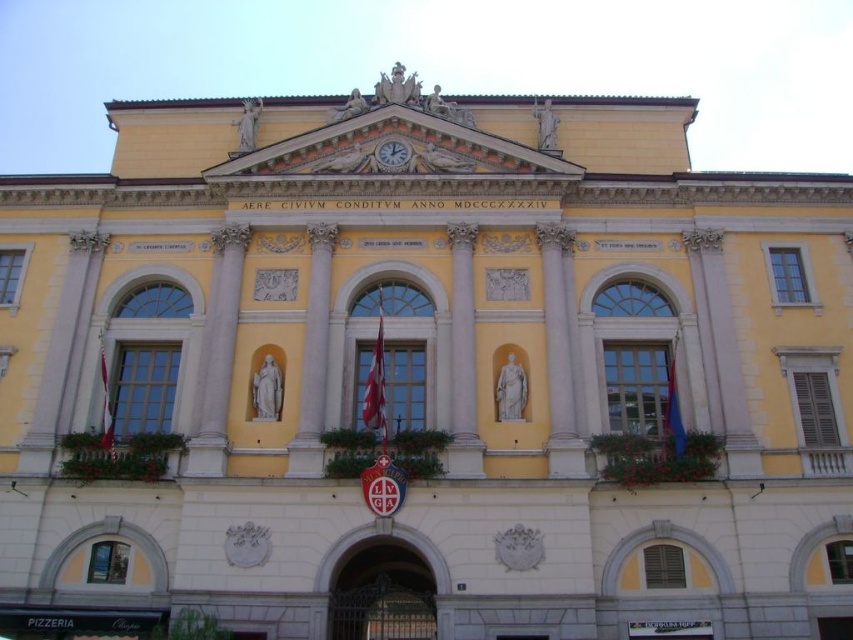
Is white marble statue at center smaller than gold metallic clock at upper center?

No.

Is point (329, 264) behind point (401, 157)?

No, (329, 264) is closer to viewer.

Locate an element on the screen. This screenshot has height=640, width=853. white marble statue at center is located at coordinates (312, 356).

Does white marble statue at center come behind white marble column at center?

Yes, it is behind white marble column at center.

Measure the distance between white marble statue at center and camera.

They are 162.16 feet apart.

Which is in front, point (311, 349) or point (471, 332)?

Point (311, 349)

Identify the location of white marble statue at center. (312, 356).

Between point (225, 260) and point (311, 342), which one is positioned behind?

The point (225, 260) is more distant.

Does point (193, 420) come farther from viewer compared to point (305, 330)?

No, it is not.

The height and width of the screenshot is (640, 853). What are the coordinates of `white marble pillar at center` in the screenshot? It's located at (218, 355).